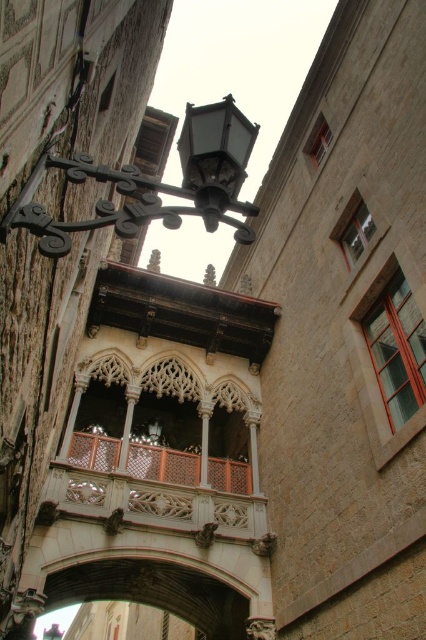
Does point (83, 467) come behind point (207, 179)?

Yes.

In the scene shown: Is carved wood balcony at center above matte black lantern at upper center?

Incorrect, carved wood balcony at center is not positioned above matte black lantern at upper center.

You are a GUI agent. You are given a task and a screenshot of the screen. Output one action in this format:
    pyautogui.click(x=<x>, y=<y>)
    Task: Click on the carved wood balcony at center
    
    Given the screenshot: What is the action you would take?
    pyautogui.click(x=155, y=486)

Which of these two, matte black lantern at upper left or carved wood balcony at center, stands taller?

Standing taller between the two is carved wood balcony at center.

Does matte black lantern at upper left appear on the right side of carved wood balcony at center?

Yes, matte black lantern at upper left is to the right of carved wood balcony at center.

Between point (196, 172) and point (109, 436), which one is positioned behind?

Positioned behind is point (109, 436).

At what (x,y) coordinates should I click in order to perform the action: click on matte black lantern at upper left. Please return your answer as a coordinate pair (x, y). The image size is (426, 640). Looking at the image, I should click on (155, 182).

Between matte black lantern at upper left and matte black lantern at upper center, which one appears on the right side from the viewer's perspective?

From the viewer's perspective, matte black lantern at upper center appears more on the right side.

Is point (229, 192) closer to camera compared to point (230, 192)?

Yes, it is.

Which is behind, point (120, 221) or point (244, 140)?

The point (244, 140) is behind.

Locate an element on the screen. matte black lantern at upper left is located at coordinates (155, 182).